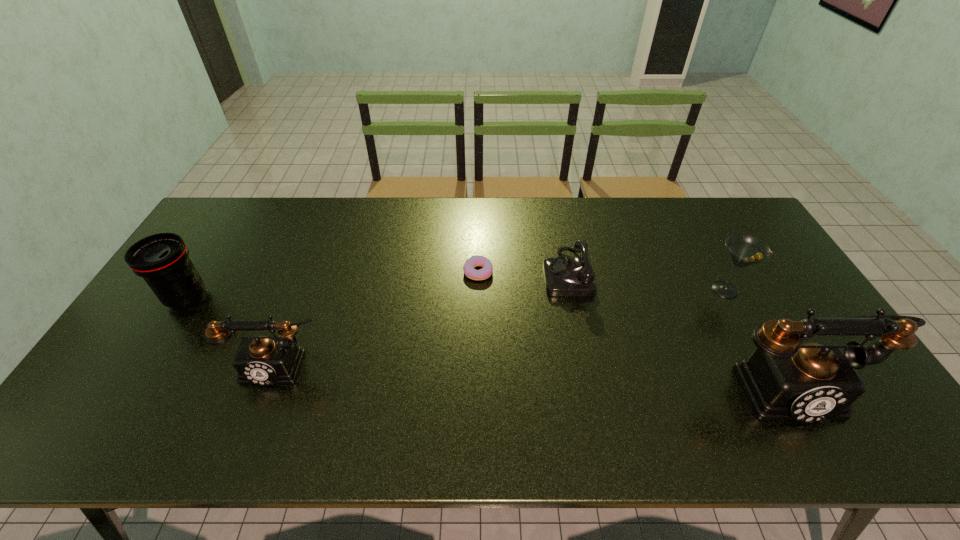
Point out which object is positioned as the nearest to the martini. Please provide its 2D coordinates. Your answer should be formatted as a tuple, i.e. [(x, y)], where the tuple contains the x and y coordinates of a point satisfying the conditions above.

[(784, 379)]

Where is `object identified as the fourth closest to the second shortest telephone`? Image resolution: width=960 pixels, height=540 pixels. object identified as the fourth closest to the second shortest telephone is located at coordinates (784, 379).

The width and height of the screenshot is (960, 540). I want to click on the third closest telephone to the martini, so click(262, 360).

You are a GUI agent. You are given a task and a screenshot of the screen. Output one action in this format:
    pyautogui.click(x=<x>, y=<y>)
    Task: Click on the second closest telephone to the martini
    The height and width of the screenshot is (540, 960).
    Given the screenshot: What is the action you would take?
    pyautogui.click(x=564, y=276)

Identify the location of free space that satisfies the following two spatial constraints: 1. on the dial of the fifth tallest object; 2. on the front of the second tallest telephone at the rotary dial. point(585,363).

The image size is (960, 540). I want to click on free point that satisfies the following two spatial constraints: 1. on the dial of the second telephone from right to left; 2. on the left side of the martini, so click(570, 290).

Where is `vacant space that satisfies the following two spatial constraints: 1. on the dial of the third object from right to left; 2. on the front of the second shortest telephone at the rotary dial`? vacant space that satisfies the following two spatial constraints: 1. on the dial of the third object from right to left; 2. on the front of the second shortest telephone at the rotary dial is located at coordinates (585, 363).

Locate an element on the screen. free space that satisfies the following two spatial constraints: 1. on the dial of the farthest telephone; 2. on the front of the second object from left to right at the rotary dial is located at coordinates (585, 363).